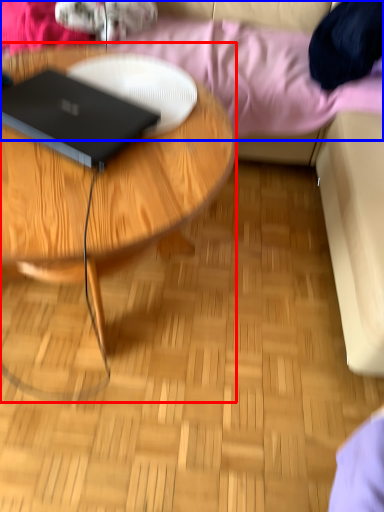
Question: Among these objects, which one is nearest to the camera, coffee table (highlighted by a red box) or bedding (highlighted by a blue box)?

Choices:
 (A) coffee table
 (B) bedding

Answer: (A)